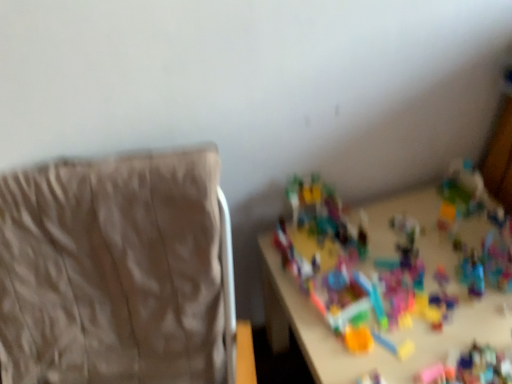
The image size is (512, 384). Describe the element at coordinates (112, 271) in the screenshot. I see `beige fabric chair at left` at that location.

In order to click on beige fabric chair at left in this screenshot , I will do `click(112, 271)`.

This screenshot has height=384, width=512. In order to click on multicolored plastic toys at center in this screenshot , I will do `click(394, 282)`.

In order to face multicolored plastic toys at center, should I rotate leftwards or rightwards?

Rotate right and turn 18.081 degrees.

What do you see at coordinates (394, 282) in the screenshot? This screenshot has width=512, height=384. I see `multicolored plastic toys at center` at bounding box center [394, 282].

This screenshot has width=512, height=384. Find the location of `beige fabric chair at left`. beige fabric chair at left is located at coordinates (112, 271).

Between beige fabric chair at left and multicolored plastic toys at center, which one appears on the left side from the viewer's perspective?

From the viewer's perspective, beige fabric chair at left appears more on the left side.

Considering the relative positions of beige fabric chair at left and multicolored plastic toys at center in the image provided, is beige fabric chair at left in front of multicolored plastic toys at center?

Yes, beige fabric chair at left is closer to the viewer.

Considering the points (67, 348) and (356, 361), which point is in front, point (67, 348) or point (356, 361)?

The point (356, 361) is in front.

From the image's perspective, is beige fabric chair at left above or below multicolored plastic toys at center?

beige fabric chair at left is below multicolored plastic toys at center.

From a real-world perspective, is beige fabric chair at left positioned above or below multicolored plastic toys at center?

Clearly, from a real-world perspective, beige fabric chair at left is above multicolored plastic toys at center.

Which object is wider, beige fabric chair at left or multicolored plastic toys at center?

beige fabric chair at left is wider.

In terms of height, does beige fabric chair at left look taller or shorter compared to multicolored plastic toys at center?

Considering their sizes, beige fabric chair at left has more height than multicolored plastic toys at center.

Considering the sizes of objects beige fabric chair at left and multicolored plastic toys at center in the image provided, who is smaller, beige fabric chair at left or multicolored plastic toys at center?

multicolored plastic toys at center.

Is beige fabric chair at left surrounding multicolored plastic toys at center?

No.

Is beige fabric chair at left not near multicolored plastic toys at center?

beige fabric chair at left is near multicolored plastic toys at center, not far away.

Could you tell me if beige fabric chair at left is turned towards multicolored plastic toys at center?

No, beige fabric chair at left does not turn towards multicolored plastic toys at center.

From the picture: Can you tell me how much beige fabric chair at left and multicolored plastic toys at center differ in facing direction?

0.183 degrees.

Locate an element on the screen. The width and height of the screenshot is (512, 384). furniture that is in front of the multicolored plastic toys at center is located at coordinates (112, 271).

Based on their positions, is multicolored plastic toys at center located to the left or right of beige fabric chair at left?

From the image, it's evident that multicolored plastic toys at center is to the right of beige fabric chair at left.

Is multicolored plastic toys at center further to the viewer compared to beige fabric chair at left?

That is True.

Considering the points (390, 352) and (148, 250), which point is in front, point (390, 352) or point (148, 250)?

The point (148, 250) is closer to the camera.

From the image's perspective, between multicolored plastic toys at center and beige fabric chair at left, who is located below?

beige fabric chair at left is shown below in the image.

From a real-world perspective, is multicolored plastic toys at center over beige fabric chair at left?

No, from a real-world perspective, multicolored plastic toys at center is not over beige fabric chair at left

Does multicolored plastic toys at center have a greater width compared to beige fabric chair at left?

No, multicolored plastic toys at center is not wider than beige fabric chair at left.

Based on the photo, can you confirm if multicolored plastic toys at center is shorter than beige fabric chair at left?

Yes, multicolored plastic toys at center is shorter than beige fabric chair at left.

Considering the sizes of multicolored plastic toys at center and beige fabric chair at left in the image, is multicolored plastic toys at center bigger or smaller than beige fabric chair at left?

Considering their sizes, multicolored plastic toys at center takes up less space than beige fabric chair at left.

Is multicolored plastic toys at center spatially inside beige fabric chair at left, or outside of it?

multicolored plastic toys at center is outside beige fabric chair at left.

Is multicolored plastic toys at center positioned far away from beige fabric chair at left?

No.

Is multicolored plastic toys at center facing towards beige fabric chair at left?

No, multicolored plastic toys at center is not aimed at beige fabric chair at left.

This screenshot has height=384, width=512. I want to click on toy below the beige fabric chair at left (from a real-world perspective), so click(394, 282).

Where is `toy behind the beige fabric chair at left`? The height and width of the screenshot is (384, 512). toy behind the beige fabric chair at left is located at coordinates (394, 282).

This screenshot has height=384, width=512. Identify the location of furniture that appears above the multicolored plastic toys at center (from a real-world perspective). pyautogui.click(x=112, y=271).